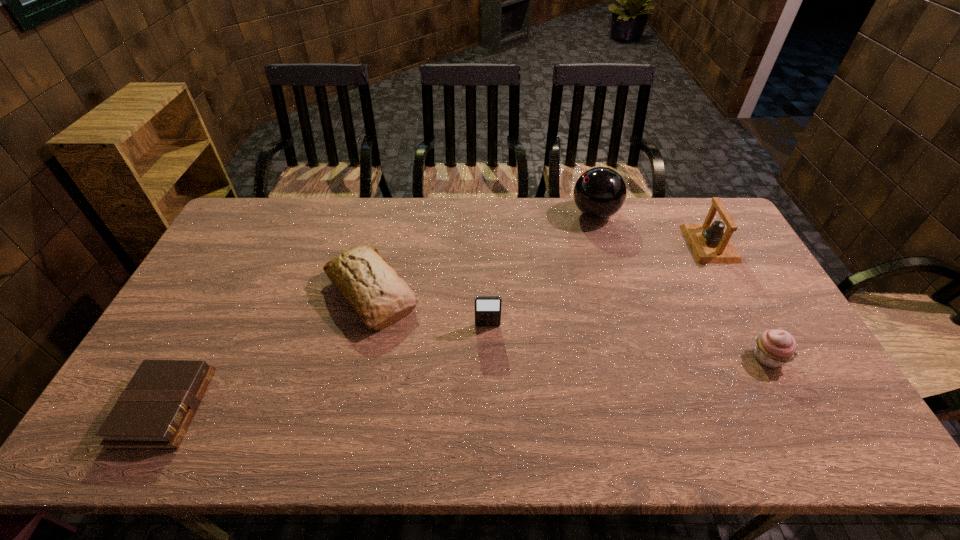
Identify the location of free space that satisfies the following two spatial constraints: 1. on the surface of the cupcake near the finger holes; 2. on the left side of the third object from right to left. (637, 357).

The height and width of the screenshot is (540, 960). Identify the location of vacant position in the image that satisfies the following two spatial constraints: 1. on the surface of the bowling ball near the finger holes; 2. on the front-facing side of the third object from left to right. (628, 326).

I want to click on blank space that satisfies the following two spatial constraints: 1. on the surface of the bowling ball near the finger holes; 2. on the back side of the cupcake, so click(637, 357).

Locate an element on the screen. vacant space that satisfies the following two spatial constraints: 1. on the back side of the bell; 2. on the surface of the third object from right to left near the finger holes is located at coordinates (693, 213).

Find the location of a particular element. vacant region that satisfies the following two spatial constraints: 1. on the front side of the second object from left to right; 2. on the spine side of the leftmost object is located at coordinates (346, 408).

Locate an element on the screen. The width and height of the screenshot is (960, 540). free space that satisfies the following two spatial constraints: 1. on the surface of the bowling ball near the finger holes; 2. on the right side of the bell is located at coordinates (604, 244).

I want to click on free space that satisfies the following two spatial constraints: 1. on the back side of the bell; 2. on the left side of the cupcake, so click(x=707, y=244).

Identify the location of vacant area in the image that satisfies the following two spatial constraints: 1. on the front-facing side of the iPod; 2. on the spine side of the shortest object. The width and height of the screenshot is (960, 540). (489, 408).